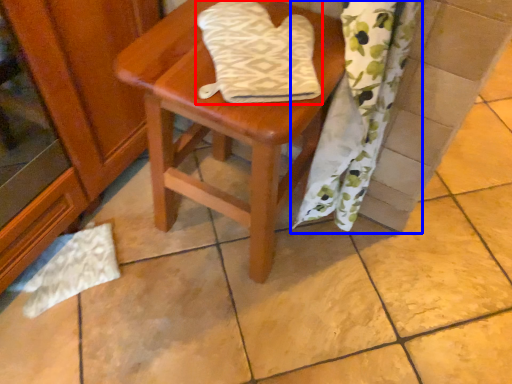
Question: Which object is closer to the camera taking this photo, beach towel (highlighted by a red box) or curtain (highlighted by a blue box)?

Choices:
 (A) beach towel
 (B) curtain

Answer: (B)